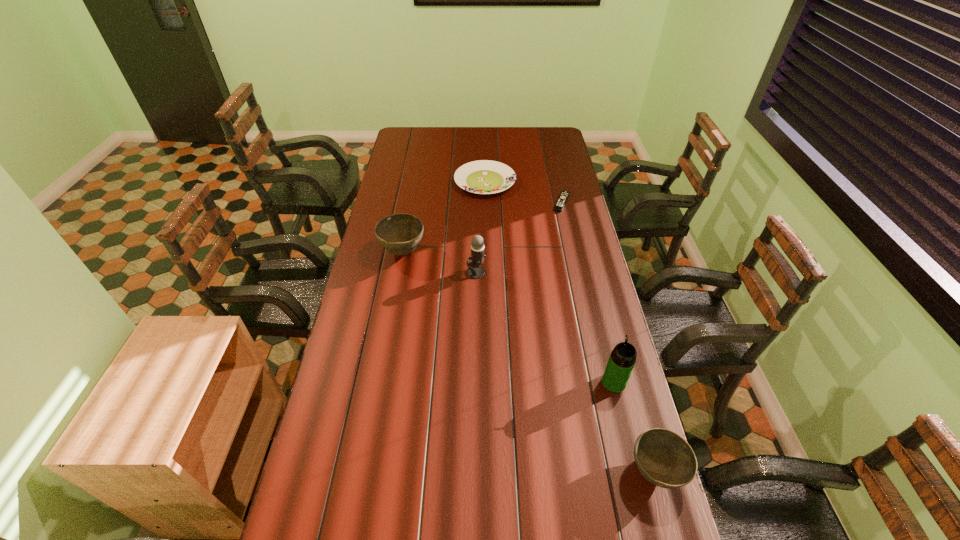
Where is `free spot between the shortest object and the third shortest object`? free spot between the shortest object and the third shortest object is located at coordinates (609, 338).

I want to click on vacant space that's between the second shortest object and the shortest object, so click(523, 192).

Where is `empty space that is in between the second shortest object and the nearer bowl`? This screenshot has width=960, height=540. empty space that is in between the second shortest object and the nearer bowl is located at coordinates (570, 327).

This screenshot has width=960, height=540. I want to click on vacant region between the fourth tallest object and the microphone, so [565, 372].

Find the location of a particular element. The width and height of the screenshot is (960, 540). free space between the third shortest object and the microphone is located at coordinates (565, 372).

The width and height of the screenshot is (960, 540). Find the location of `free space between the salad plate and the second nearest object`. free space between the salad plate and the second nearest object is located at coordinates (549, 282).

Identify which object is located as the fourth nearest to the salad plate. Please provide its 2D coordinates. Your answer should be formatted as a tuple, i.e. [(x, y)], where the tuple contains the x and y coordinates of a point satisfying the conditions above.

[(621, 362)]

Find the location of `object identified as the second closest to the shorter bowl`. object identified as the second closest to the shorter bowl is located at coordinates (475, 271).

This screenshot has height=540, width=960. I want to click on vacant area in the image that satisfies the following two spatial constraints: 1. on the front side of the fourth tallest object; 2. on the left side of the shortest object, so click(x=622, y=472).